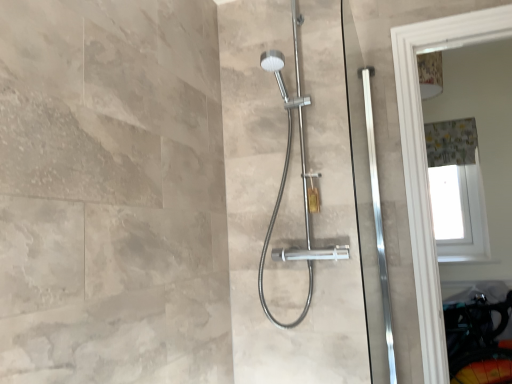
Question: From the image's perspective, does gray fabric shower curtain at upper right appear lower than satin nickel shower head at center?

Choices:
 (A) yes
 (B) no

Answer: (B)

Question: Is gray fabric shower curtain at upper right bigger than satin nickel shower head at center?

Choices:
 (A) no
 (B) yes

Answer: (A)

Question: Is gray fabric shower curtain at upper right closer to the viewer compared to satin nickel shower head at center?

Choices:
 (A) yes
 (B) no

Answer: (B)

Question: Can you see gray fabric shower curtain at upper right touching satin nickel shower head at center?

Choices:
 (A) no
 (B) yes

Answer: (A)

Question: Considering the relative sizes of gray fabric shower curtain at upper right and satin nickel shower head at center in the image provided, is gray fabric shower curtain at upper right taller than satin nickel shower head at center?

Choices:
 (A) yes
 (B) no

Answer: (B)

Question: Is gray fabric shower curtain at upper right positioned beyond the bounds of satin nickel shower head at center?

Choices:
 (A) no
 (B) yes

Answer: (B)

Question: Is the surface of satin nickel shower head at center in direct contact with gray fabric shower curtain at upper right?

Choices:
 (A) no
 (B) yes

Answer: (A)

Question: Is satin nickel shower head at center far away from gray fabric shower curtain at upper right?

Choices:
 (A) no
 (B) yes

Answer: (B)

Question: Can you confirm if satin nickel shower head at center is wider than gray fabric shower curtain at upper right?

Choices:
 (A) no
 (B) yes

Answer: (B)

Question: Can you confirm if satin nickel shower head at center is shorter than gray fabric shower curtain at upper right?

Choices:
 (A) yes
 (B) no

Answer: (B)

Question: Could you tell me if satin nickel shower head at center is turned towards gray fabric shower curtain at upper right?

Choices:
 (A) yes
 (B) no

Answer: (B)

Question: From a real-world perspective, is satin nickel shower head at center under gray fabric shower curtain at upper right?

Choices:
 (A) yes
 (B) no

Answer: (A)

Question: Do you think gray fabric shower curtain at upper right is within satin nickel shower head at center, or outside of it?

Choices:
 (A) outside
 (B) inside

Answer: (A)